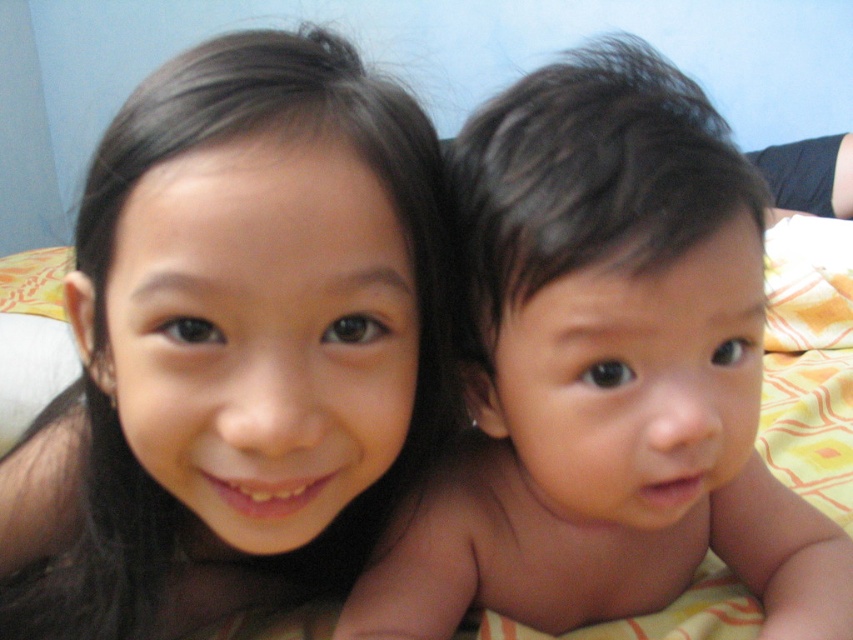
You are a photographer adjusting your camera settings to capture a clear photo of the smooth skin girl at center. What is the recommended focus distance for the camera to ensure her face is sharp?

The smooth skin girl at center is 29.50 centimeters away from the camera, so the recommended focus distance should be set to 29.50 centimeters to ensure her face is in sharp focus.